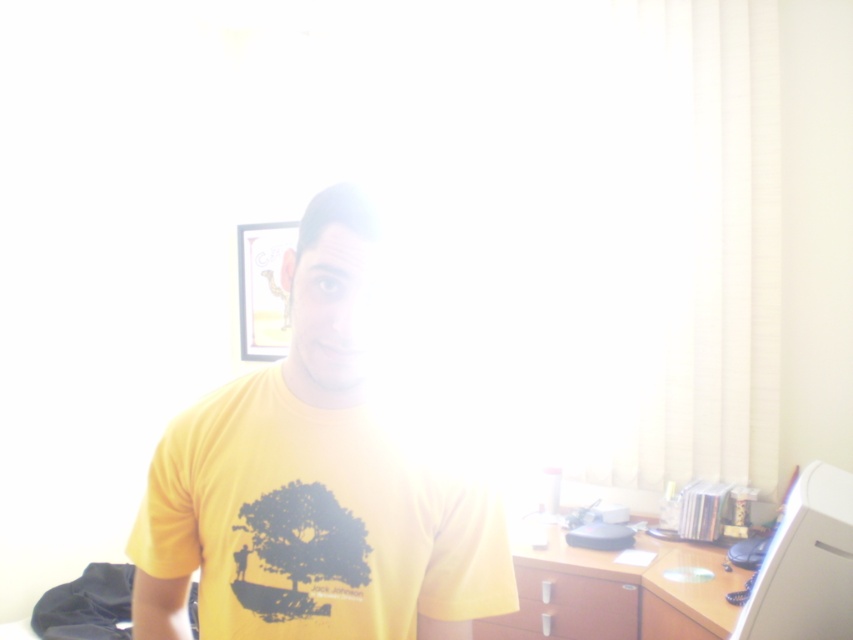
Question: Among these points, which one is farthest from the camera?

Choices:
 (A) (827, 525)
 (B) (387, 524)
 (C) (614, 589)

Answer: (C)

Question: From the image, what is the correct spatial relationship of brown wood dresser at lower right in relation to matte brown drawer at lower center?

Choices:
 (A) left
 (B) right

Answer: (B)

Question: Considering the real-world distances, which object is closest to the brown wood dresser at lower right?

Choices:
 (A) yellow matte t-shirt at center
 (B) white plastic computer at right
 (C) matte brown drawer at lower center

Answer: (C)

Question: Which object is closer to the camera taking this photo?

Choices:
 (A) matte brown drawer at lower center
 (B) brown wood dresser at lower right

Answer: (B)

Question: Does yellow matte t-shirt at center appear over white plastic computer at right?

Choices:
 (A) no
 (B) yes

Answer: (B)

Question: Where is yellow matte t-shirt at center located in relation to matte brown drawer at lower center in the image?

Choices:
 (A) above
 (B) below

Answer: (A)